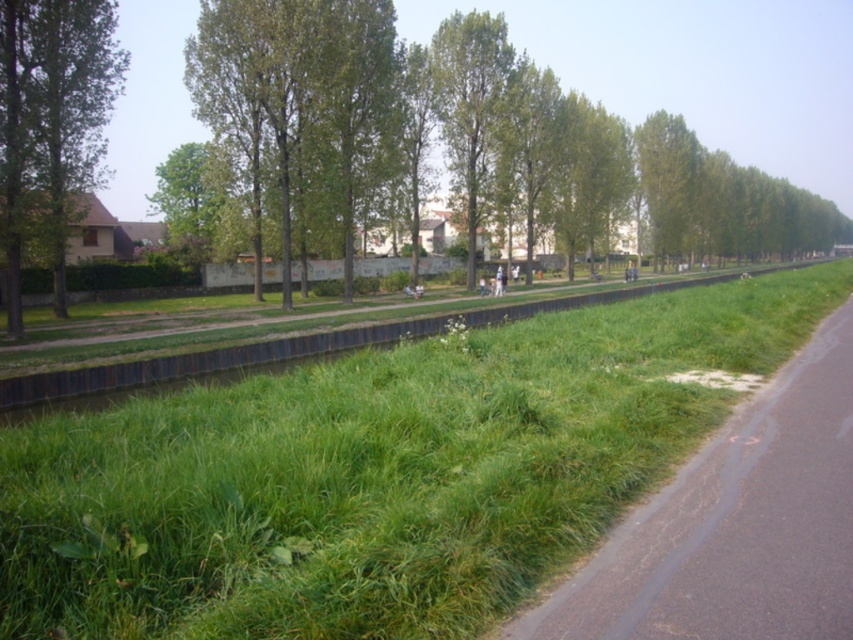
Question: Which object appears closest to the camera in this image?

Choices:
 (A) green grass at center
 (B) green leafy tree at left
 (C) green leafy tree at upper left

Answer: (A)

Question: Can you confirm if green leafy tree at left is thinner than green leafy tree at upper left?

Choices:
 (A) no
 (B) yes

Answer: (A)

Question: Is green grass at lower right to the left of green leafy tree at upper left from the viewer's perspective?

Choices:
 (A) yes
 (B) no

Answer: (B)

Question: Is green leafy tree at left to the right of green leafy tree at upper left from the viewer's perspective?

Choices:
 (A) no
 (B) yes

Answer: (A)

Question: Which of the following is the farthest from the observer?

Choices:
 (A) green grass at lower right
 (B) green grass at center
 (C) green leafy tree at left

Answer: (C)

Question: Which point is farther to the camera?

Choices:
 (A) green leafy tree at left
 (B) green grass at center

Answer: (A)